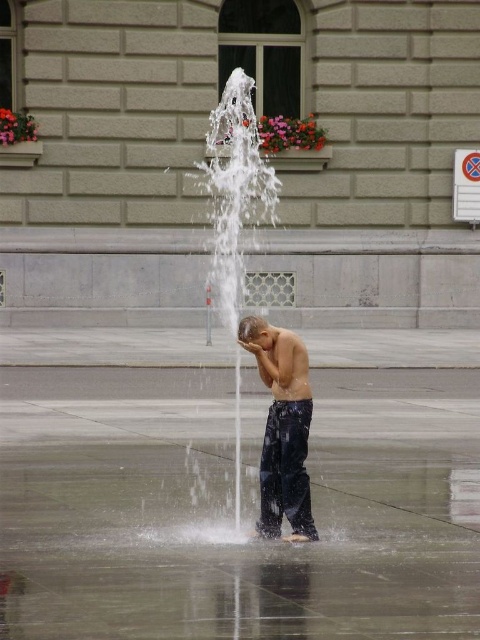
Looking at this image, does white frothy water at center have a larger size compared to dark blue jeans at center?

Indeed, white frothy water at center has a larger size compared to dark blue jeans at center.

At what (x,y) coordinates should I click in order to perform the action: click on white frothy water at center. Please return your answer as a coordinate pair (x, y). Looking at the image, I should click on (253, 314).